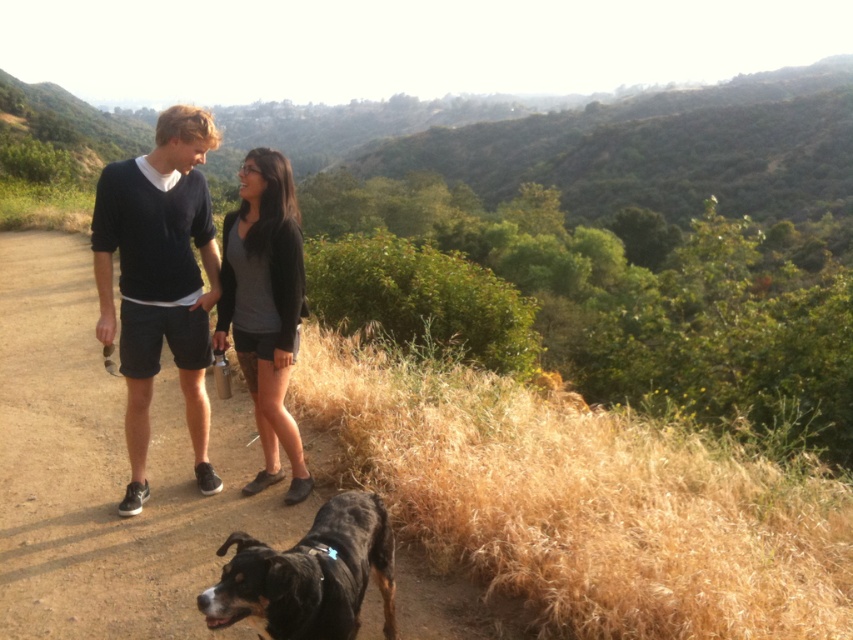
You are a photographer standing at the center of the dirt path. You want to take a photo that includes both the black cotton shorts at center and the black fur dog at lower left. Can you fit both subjects in the frame without moving either of them?

The distance between the black cotton shorts at center and the black fur dog at lower left is 2.26 meters. Assuming a typical camera lens with a standard focal length, this distance is manageable within a single frame without requiring movement.

You are a photographer trying to capture a photo of the black cotton shorts at center and the black fur dog at lower left. Since you want to ensure both subjects are in focus, you need to know which one is taller. Which object is shorter?

The black cotton shorts at center has a lesser height compared to black fur dog at lower left, so the black cotton shorts at center is shorter.